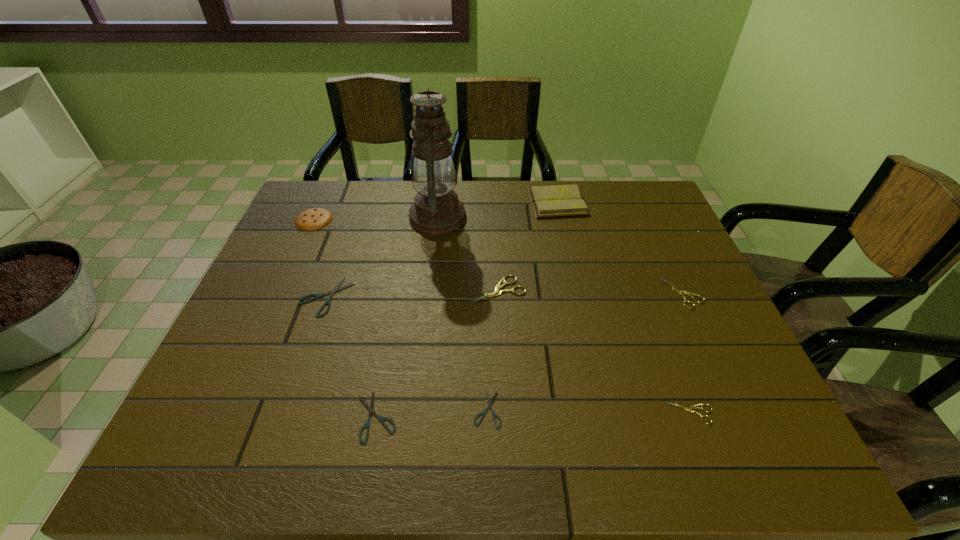
Find the location of `the smallest beige shears`. the smallest beige shears is located at coordinates (690, 409).

Identify the location of the second beige shears from right to left. Image resolution: width=960 pixels, height=540 pixels. (690, 409).

Image resolution: width=960 pixels, height=540 pixels. In order to click on the second shears from left to right in this screenshot , I will do `click(371, 407)`.

Identify the location of the second biggest black shears. (371, 407).

Identify the location of the shortest shears. The height and width of the screenshot is (540, 960). (483, 413).

What are the coordinates of `the rightmost black shears` in the screenshot? It's located at (483, 413).

This screenshot has height=540, width=960. What are the coordinates of `free location located 0.050m on the left of the tallest object` in the screenshot? It's located at (393, 217).

Identify the location of free space located on the front of the diary. The image size is (960, 540). (581, 306).

At what (x,y) coordinates should I click in order to perform the action: click on free spot located 0.290m on the front of the cookie. Please return your answer as a coordinate pair (x, y). Looking at the image, I should click on tap(277, 300).

At what (x,y) coordinates should I click in order to perform the action: click on vacant position located on the front of the leftmost beige shears. Please return your answer as a coordinate pair (x, y). Looking at the image, I should click on (499, 326).